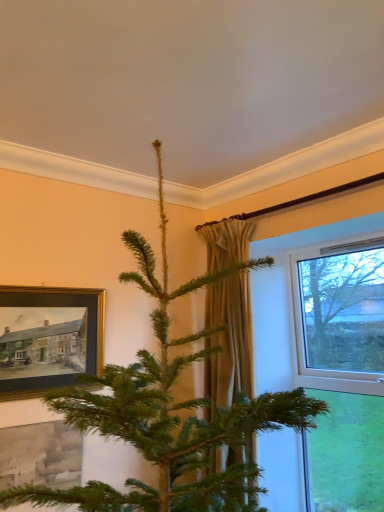
Question: From the image's perspective, would you say green matte christmas tree at center is positioned over beige fabric curtain at center?

Choices:
 (A) yes
 (B) no

Answer: (A)

Question: Can you confirm if green matte christmas tree at center is taller than beige fabric curtain at center?

Choices:
 (A) yes
 (B) no

Answer: (A)

Question: Does green matte christmas tree at center have a larger size compared to beige fabric curtain at center?

Choices:
 (A) yes
 (B) no

Answer: (A)

Question: Does green matte christmas tree at center appear on the right side of beige fabric curtain at center?

Choices:
 (A) no
 (B) yes

Answer: (A)

Question: Could you tell me if green matte christmas tree at center is facing beige fabric curtain at center?

Choices:
 (A) no
 (B) yes

Answer: (A)

Question: Considering the relative sizes of green matte christmas tree at center and beige fabric curtain at center in the image provided, is green matte christmas tree at center wider than beige fabric curtain at center?

Choices:
 (A) no
 (B) yes

Answer: (B)

Question: Can you confirm if gold-framed painting at left is shorter than beige fabric curtain at center?

Choices:
 (A) yes
 (B) no

Answer: (A)

Question: From the image's perspective, does gold-framed painting at left appear higher than beige fabric curtain at center?

Choices:
 (A) no
 (B) yes

Answer: (B)

Question: Does gold-framed painting at left appear on the right side of beige fabric curtain at center?

Choices:
 (A) no
 (B) yes

Answer: (A)

Question: Is gold-framed painting at left aimed at beige fabric curtain at center?

Choices:
 (A) no
 (B) yes

Answer: (A)

Question: Is gold-framed painting at left further to the viewer compared to beige fabric curtain at center?

Choices:
 (A) yes
 (B) no

Answer: (B)

Question: From a real-world perspective, is gold-framed painting at left below beige fabric curtain at center?

Choices:
 (A) no
 (B) yes

Answer: (A)

Question: Is clear glass window at right bigger than beige fabric curtain at center?

Choices:
 (A) no
 (B) yes

Answer: (B)